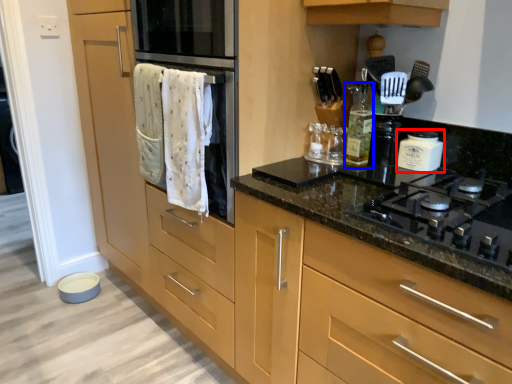
Question: Among these objects, which one is farthest to the camera, kitchen appliance (highlighted by a red box) or bottle (highlighted by a blue box)?

Choices:
 (A) kitchen appliance
 (B) bottle

Answer: (B)